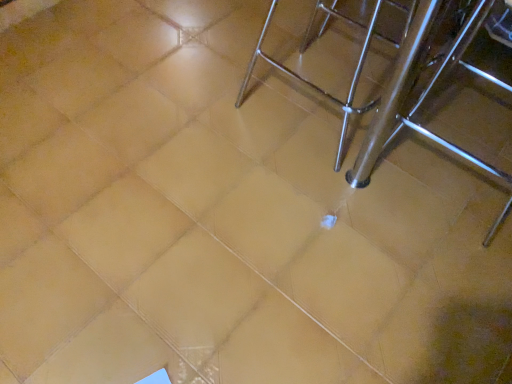
Where is `free region on the left part of silver metallic stool at center`? free region on the left part of silver metallic stool at center is located at coordinates (170, 109).